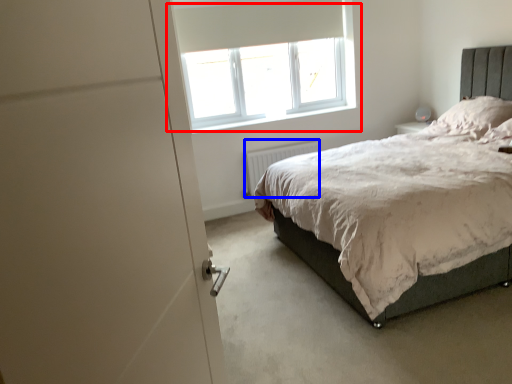
Question: Which object is closer to the camera taking this photo, window (highlighted by a red box) or radiator (highlighted by a blue box)?

Choices:
 (A) window
 (B) radiator

Answer: (A)